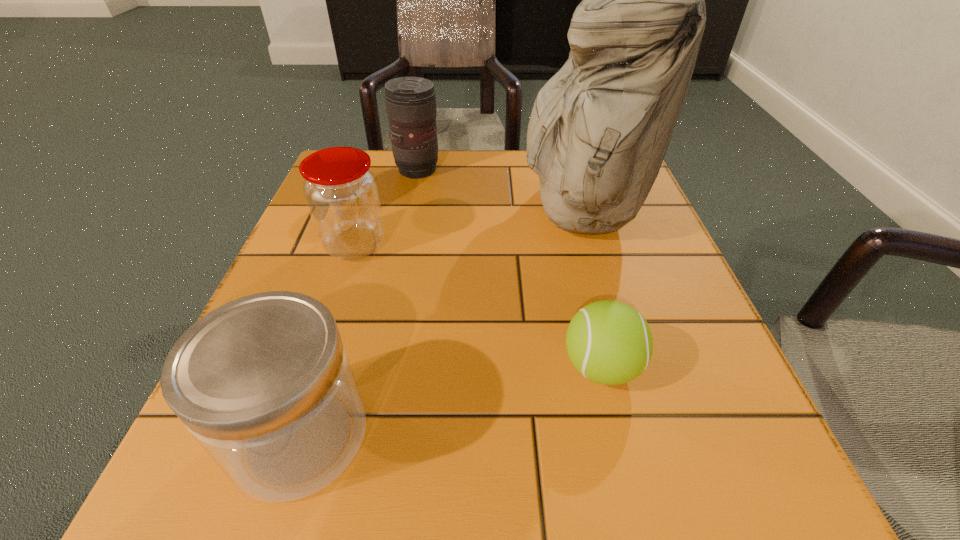
You are a GUI agent. You are given a task and a screenshot of the screen. Output one action in this format:
    pyautogui.click(x=<x>, y=<y>)
    Task: Click on the vacant region located 0.290m on the back of the nearer jar
    
    Given the screenshot: What is the action you would take?
    pyautogui.click(x=359, y=247)

Where is `blank space located 0.320m on the back of the tennis ball`? blank space located 0.320m on the back of the tennis ball is located at coordinates (564, 214).

Where is `backpack at the far edge`? This screenshot has height=540, width=960. backpack at the far edge is located at coordinates (600, 127).

In order to click on telephoto lens located at the far edge in this screenshot , I will do `click(410, 102)`.

Identify the location of object at the near edge. 264,384.

In order to click on telephoto lens located in the left edge section of the desktop in this screenshot , I will do `click(410, 102)`.

Where is `backpack present at the right edge`? This screenshot has width=960, height=540. backpack present at the right edge is located at coordinates (600, 127).

At what (x,y) coordinates should I click in order to perform the action: click on tennis ball that is positioned at the right edge. Please return your answer as a coordinate pair (x, y). Looking at the image, I should click on (609, 342).

Where is `object positioned at the far left corner`? The image size is (960, 540). object positioned at the far left corner is located at coordinates (410, 102).

This screenshot has width=960, height=540. I want to click on object located at the near left corner, so click(264, 384).